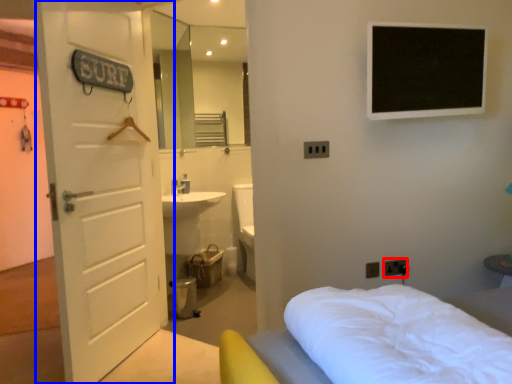
Question: Which of the following is the closest to the observer, electric outlet (highlighted by a red box) or door (highlighted by a blue box)?

Choices:
 (A) electric outlet
 (B) door

Answer: (B)